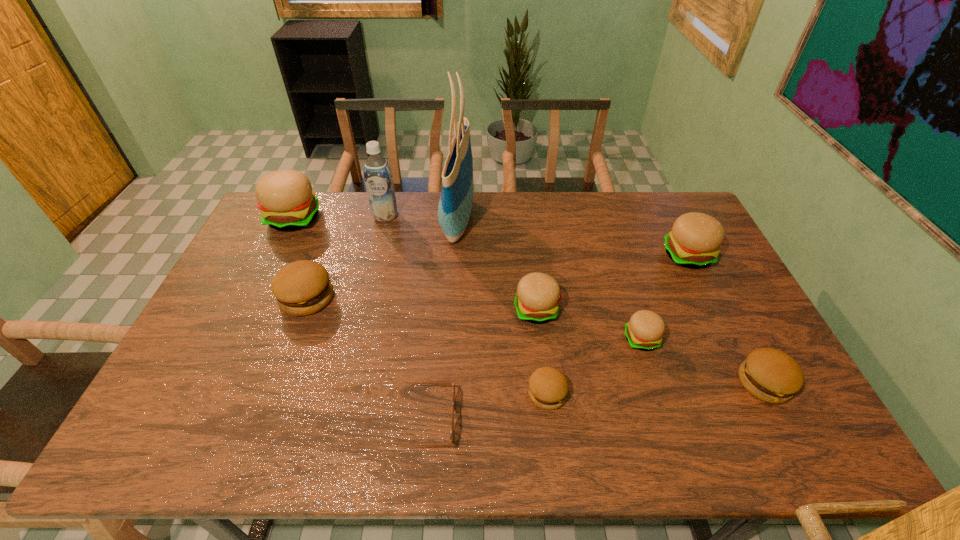
Locate an element on the screen. This screenshot has height=540, width=960. the tallest object is located at coordinates (456, 200).

In order to click on tote bag in this screenshot , I will do `click(456, 200)`.

Find the location of `soya milk`. soya milk is located at coordinates (377, 171).

Identify the location of the ninth shortest object. The height and width of the screenshot is (540, 960). (377, 171).

This screenshot has width=960, height=540. I want to click on the eighth shortest object, so click(286, 201).

This screenshot has width=960, height=540. Identify the location of the leftmost beige hamburger. (286, 201).

Where is `the second biggest beige hamburger`? The height and width of the screenshot is (540, 960). the second biggest beige hamburger is located at coordinates (694, 242).

The width and height of the screenshot is (960, 540). I want to click on the seventh shortest object, so click(x=694, y=242).

In order to click on the second smallest beige hamburger in this screenshot , I will do (538, 294).

The width and height of the screenshot is (960, 540). In order to click on the farthest brown hamburger in this screenshot , I will do `click(301, 288)`.